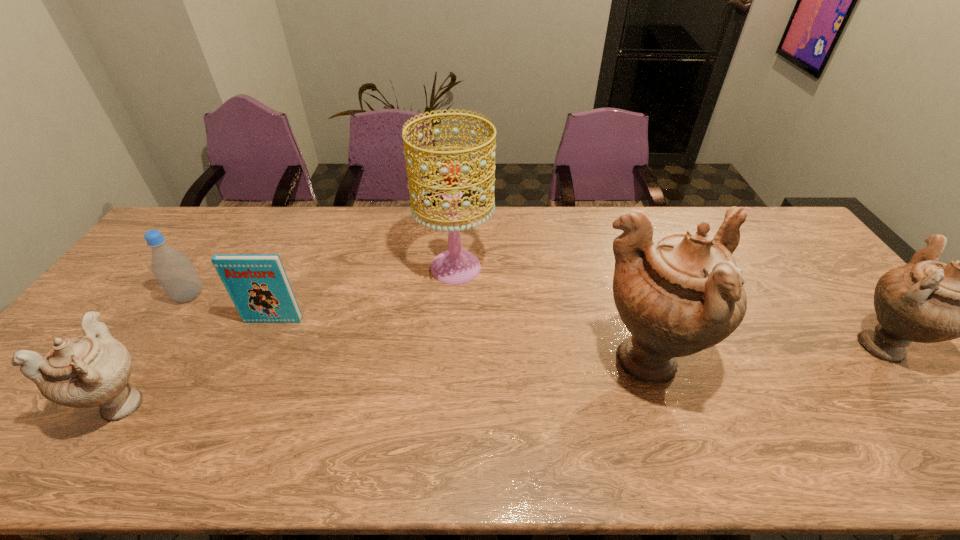
Where is `vacant space situated 0.140m on the back of the fourth shortest object`? The height and width of the screenshot is (540, 960). vacant space situated 0.140m on the back of the fourth shortest object is located at coordinates (826, 280).

Where is `vacant space located on the right of the bottle`? Image resolution: width=960 pixels, height=540 pixels. vacant space located on the right of the bottle is located at coordinates (239, 295).

Find the location of a particular element. The image size is (960, 540). vacant space located on the front cover of the book is located at coordinates (261, 349).

Find the location of a particular element. vacant space situated on the left of the lampshade is located at coordinates [292, 267].

Locate an element on the screen. object situated at the far edge is located at coordinates (455, 266).

Where is `object present at the right edge`? This screenshot has height=540, width=960. object present at the right edge is located at coordinates (926, 301).

Where is `free spot at the far edge of the desktop`? This screenshot has height=540, width=960. free spot at the far edge of the desktop is located at coordinates (280, 218).

Locate an element on the screen. blank area at the near edge is located at coordinates (801, 413).

This screenshot has height=540, width=960. In the image, there is a desktop. What are the coordinates of `vacant space at the left edge` in the screenshot? It's located at (124, 313).

Identify the location of blank space at the right edge of the desktop. The image size is (960, 540). (839, 300).